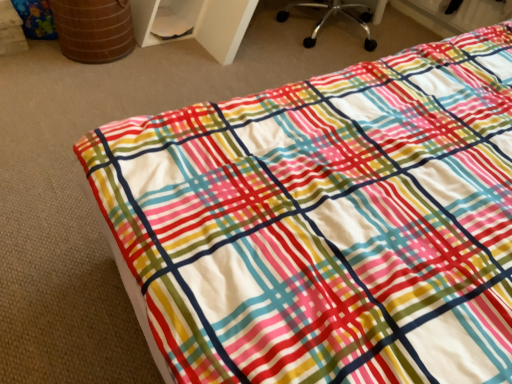
This screenshot has width=512, height=384. I want to click on blank area to the left of metallic silver chair at upper center, so click(263, 38).